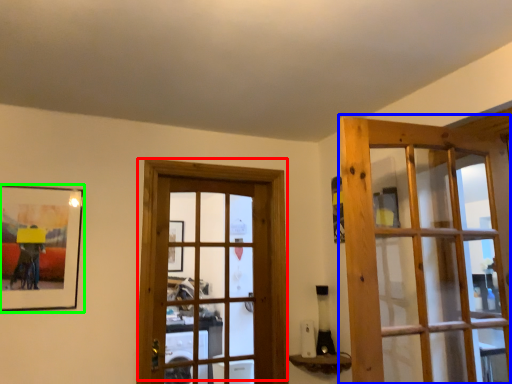
Question: Which object is the closest to the door (highlighted by a red box)? Choose among these: door (highlighted by a blue box) or picture frame (highlighted by a green box).

Choices:
 (A) door
 (B) picture frame

Answer: (B)